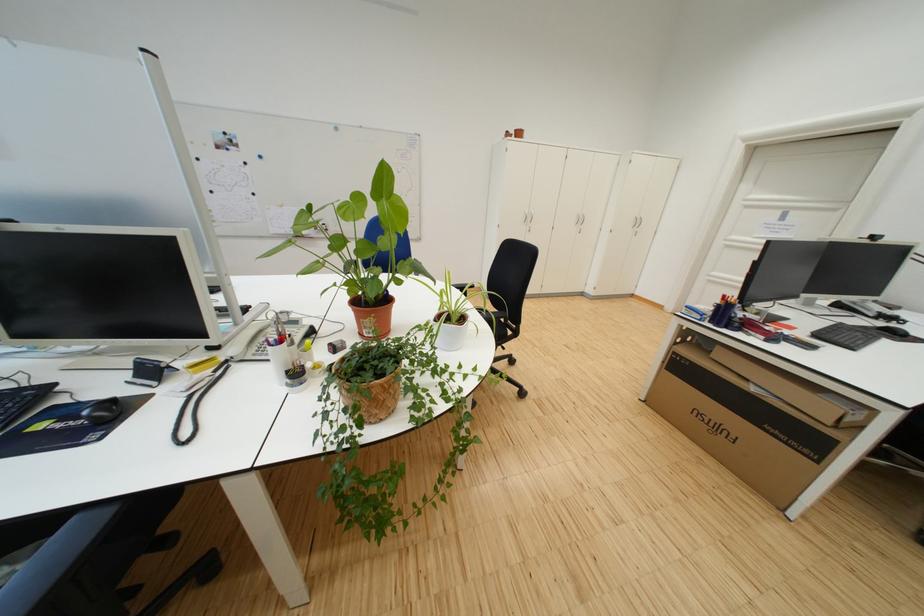
Where is `white telephone handset`? white telephone handset is located at coordinates (250, 331).